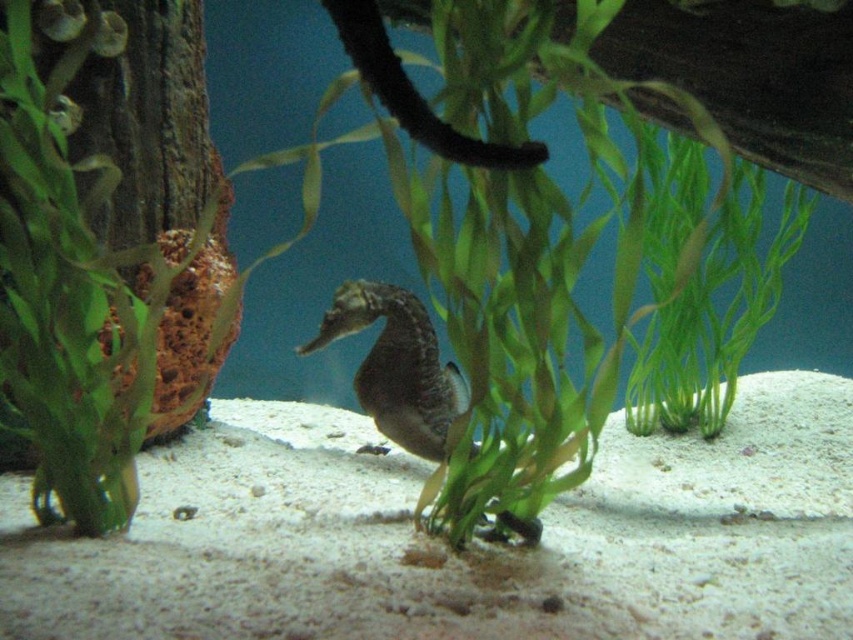
Can you confirm if green leafy plant at center is positioned below smooth gray seahorse at center?

Incorrect, green leafy plant at center is not positioned below smooth gray seahorse at center.

Between point (618, 305) and point (363, 360), which one is positioned in front?

Point (618, 305) is more forward.

Find the location of a particular element. The width and height of the screenshot is (853, 640). green leafy plant at center is located at coordinates (505, 276).